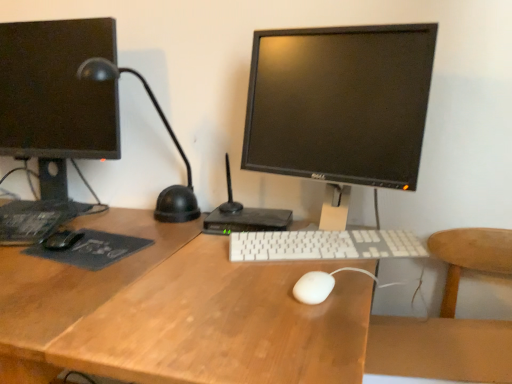
Locate an element on the screen. vacant space that is in between white plastic keyboard at center and dark gray matte mousepad at left is located at coordinates (172, 246).